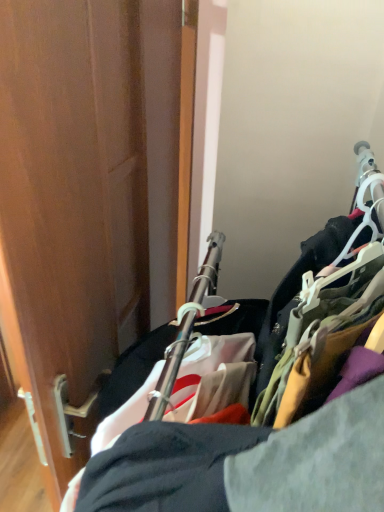
Question: Considering the positions of cloth hangers at right and wooden door at left in the image, is cloth hangers at right taller or shorter than wooden door at left?

Choices:
 (A) tall
 (B) short

Answer: (A)

Question: From a real-world perspective, is cloth hangers at right above or below wooden door at left?

Choices:
 (A) above
 (B) below

Answer: (B)

Question: Is cloth hangers at right bigger or smaller than wooden door at left?

Choices:
 (A) small
 (B) big

Answer: (B)

Question: Is point (44, 334) closer or farther from the camera than point (362, 316)?

Choices:
 (A) farther
 (B) closer

Answer: (A)

Question: Is wooden door at left bigger or smaller than cloth hangers at right?

Choices:
 (A) small
 (B) big

Answer: (A)

Question: In the image, is wooden door at left positioned in front of or behind cloth hangers at right?

Choices:
 (A) behind
 (B) front

Answer: (A)

Question: Is wooden door at left inside or outside of cloth hangers at right?

Choices:
 (A) outside
 (B) inside

Answer: (A)